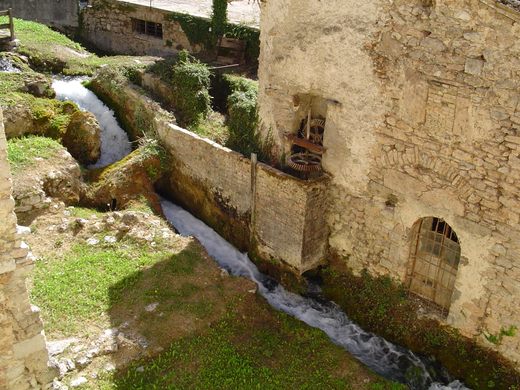
The image size is (520, 390). What are the coordinates of `bars` in the screenshot? It's located at (437, 266).